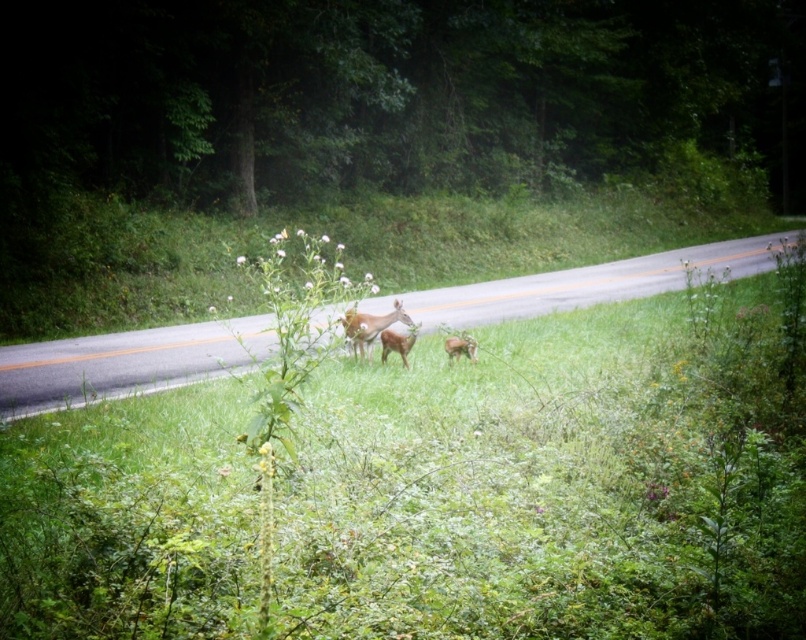
Question: Which of the following is the closest to the observer?

Choices:
 (A) brown fur deer at center
 (B) green grass at center
 (C) brown matte deer at center
 (D) green leafy grass at center

Answer: (D)

Question: Is green leafy grass at center wider than brown furry deer at center?

Choices:
 (A) no
 (B) yes

Answer: (B)

Question: Which point is closer to the camera taking this photo?

Choices:
 (A) (401, 518)
 (B) (372, 344)

Answer: (A)

Question: Considering the real-world distances, which object is closest to the green grass at center?

Choices:
 (A) brown furry deer at center
 (B) brown fur deer at center
 (C) brown matte deer at center

Answer: (C)

Question: In this image, where is green leafy grass at center located relative to brown fur deer at center?

Choices:
 (A) above
 (B) below

Answer: (B)

Question: Does brown matte deer at center appear on the left side of brown furry deer at center?

Choices:
 (A) yes
 (B) no

Answer: (A)